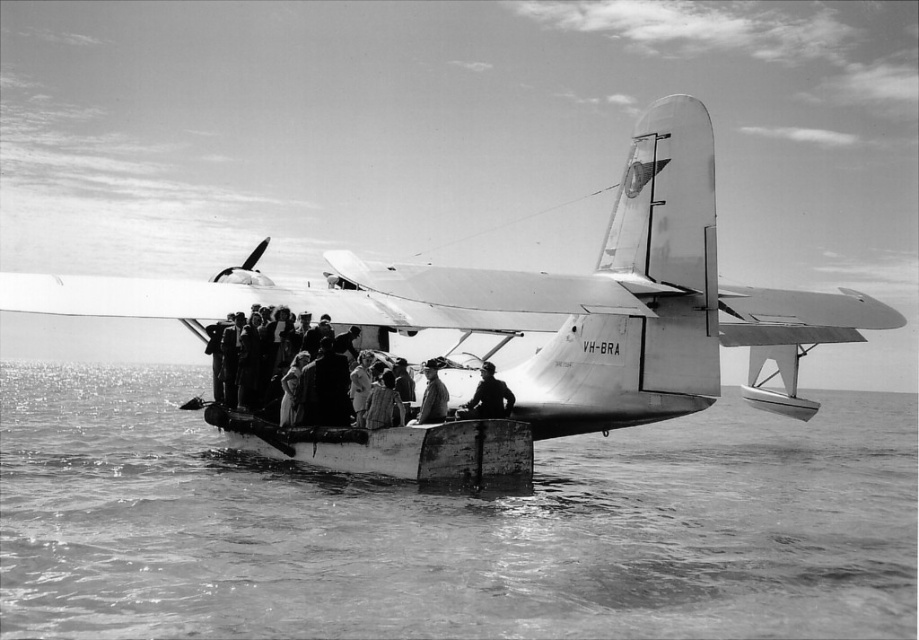
Question: Which point is farther to the camera?

Choices:
 (A) metallic fuselage seaplane at center
 (B) dark fabric jacket at center
 (C) smooth leather jacket at center
 (D) smooth water at lower center

Answer: (B)

Question: Does wooden boat at center have a larger size compared to smooth leather jacket at center?

Choices:
 (A) no
 (B) yes

Answer: (B)

Question: Which point is closer to the camera taking this photo?

Choices:
 (A) (444, 385)
 (B) (108, 540)
 (C) (637, 259)
 (D) (505, 472)

Answer: (B)

Question: Is metallic fuselage seaplane at center bigger than dark fabric jacket at center?

Choices:
 (A) no
 (B) yes

Answer: (B)

Question: Can you confirm if smooth water at lower center is positioned to the right of metallic fuselage seaplane at center?

Choices:
 (A) no
 (B) yes

Answer: (A)

Question: Estimate the real-world distances between objects in this image. Which object is farther from the dark fabric jacket at center?

Choices:
 (A) wooden boat at center
 (B) smooth water at lower center
 (C) metallic fuselage seaplane at center

Answer: (B)